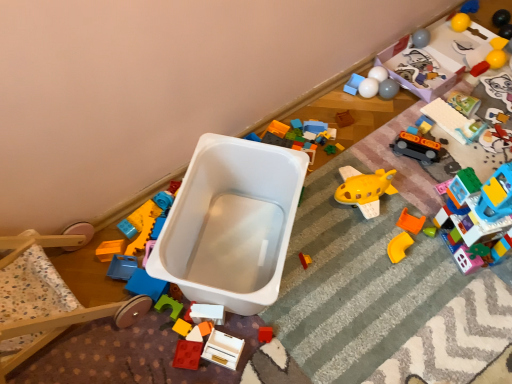
Locate an element on the screen. vacant area that lies between matte yellow toy airplane at center, placed as the 12th toy when sorted from right to left, and matte gray cat at upper right, acting as the 2th toy starting from the right is located at coordinates (430, 162).